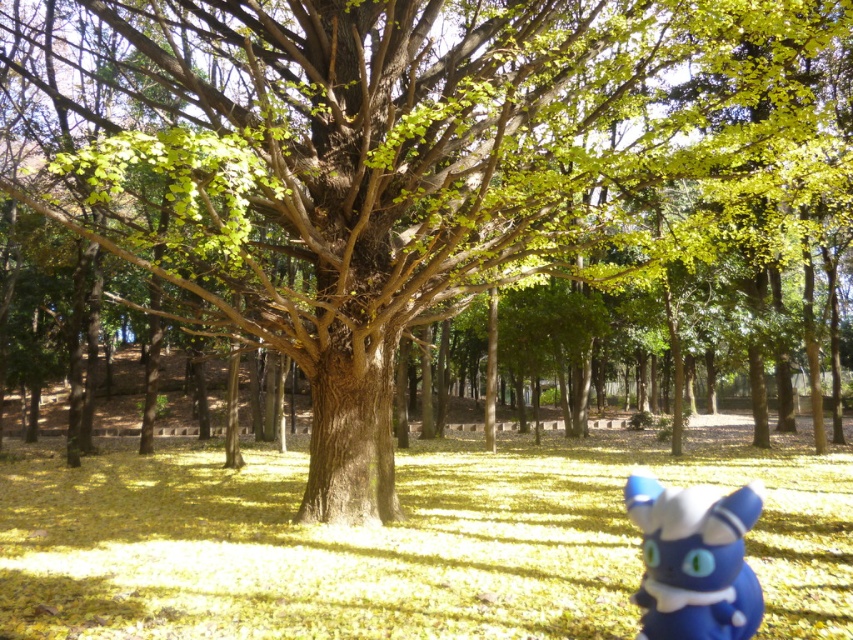
You are a child playing in the park and you see the yellow matte grass at center and the blue matte plush toy at lower right. Which object is taller?

The yellow matte grass at center is taller than the blue matte plush toy at lower right.

You are a child searching for a lost item in the autumn park scene. You see the yellow matte grass at center and the blue matte plush toy at lower right. Which object is closer to you?

The yellow matte grass at center is closer to you because the blue matte plush toy at lower right is behind it.

You are standing at the base of the large tree in the autumn scene. Looking around, you notice a point marked at coordinates (398, 540). What object is located at this point?

The point at coordinates (398, 540) indicates yellow matte grass at center.